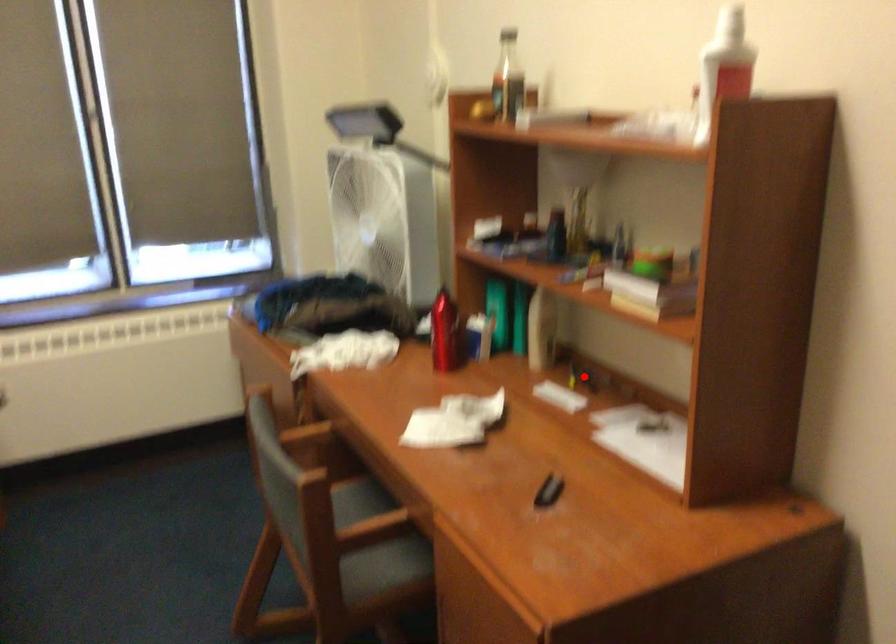
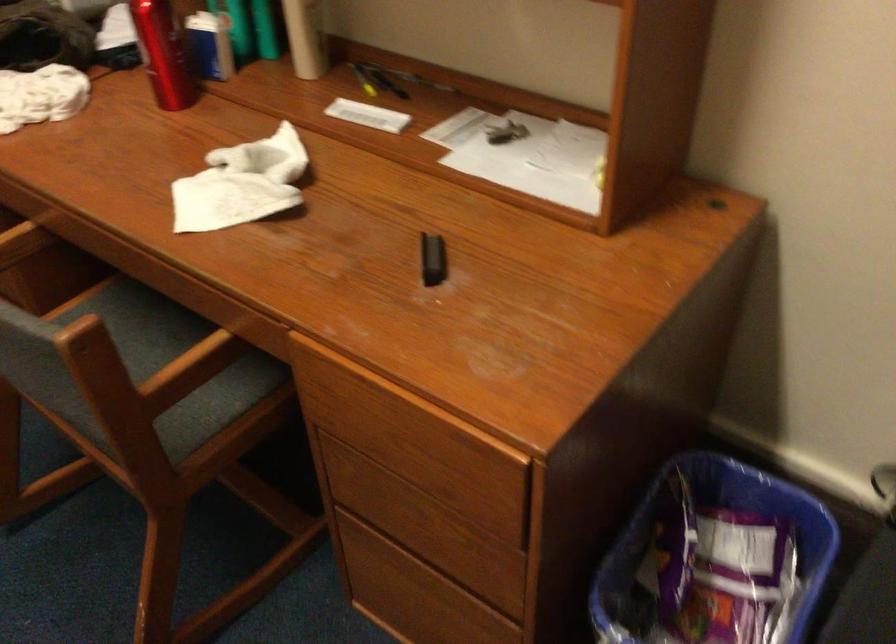
Question: I am providing you with two images of the same scene from different viewpoints. In image1, a red point is highlighted. Considering the same 3D point in image2, which of the following is correct?

Choices:
 (A) It is closer
 (B) It is farther

Answer: (A)